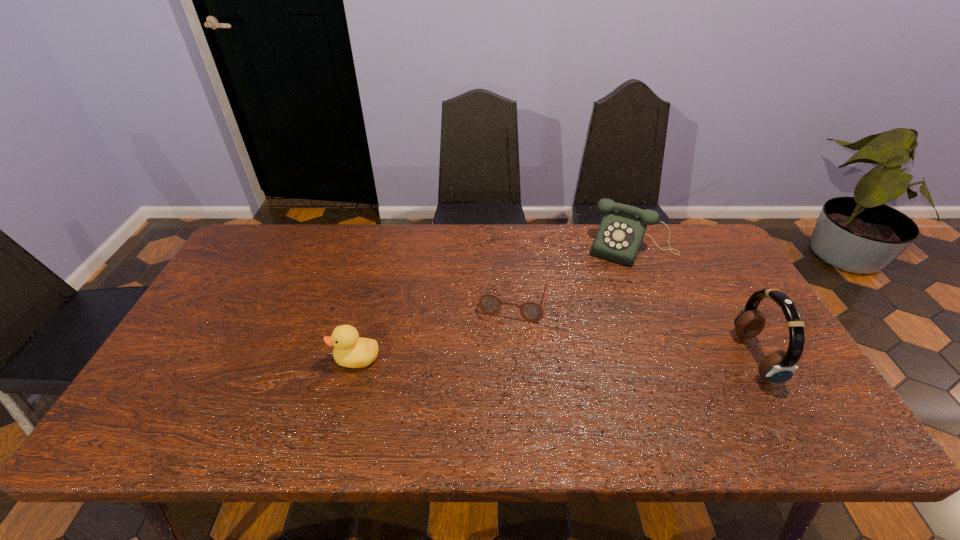
Identify the location of vacant area that lies between the third nearest object and the leftmost object. This screenshot has width=960, height=540. (436, 328).

This screenshot has height=540, width=960. Identify the location of vacant area that lies between the spectacles and the rightmost object. (635, 327).

This screenshot has width=960, height=540. In order to click on free space between the shortest object and the farthest object in this screenshot , I will do `click(574, 273)`.

Where is `vacant area between the farthest object and the headset`? This screenshot has width=960, height=540. vacant area between the farthest object and the headset is located at coordinates [x=693, y=302].

I want to click on vacant area that lies between the third object from left to right and the spectacles, so click(574, 273).

The image size is (960, 540). I want to click on vacant space in between the telephone and the spectacles, so click(574, 273).

Locate an element on the screen. free area in between the tallest object and the third nearest object is located at coordinates (635, 327).

Locate an element on the screen. The image size is (960, 540). unoccupied area between the headset and the second object from left to right is located at coordinates (635, 327).

Where is `free space between the second object from left to right and the second object from right to left`? Image resolution: width=960 pixels, height=540 pixels. free space between the second object from left to right and the second object from right to left is located at coordinates (574, 273).

Identify which object is located as the second nearest to the spectacles. Please provide its 2D coordinates. Your answer should be formatted as a tuple, i.e. [(x, y)], where the tuple contains the x and y coordinates of a point satisfying the conditions above.

[(350, 350)]